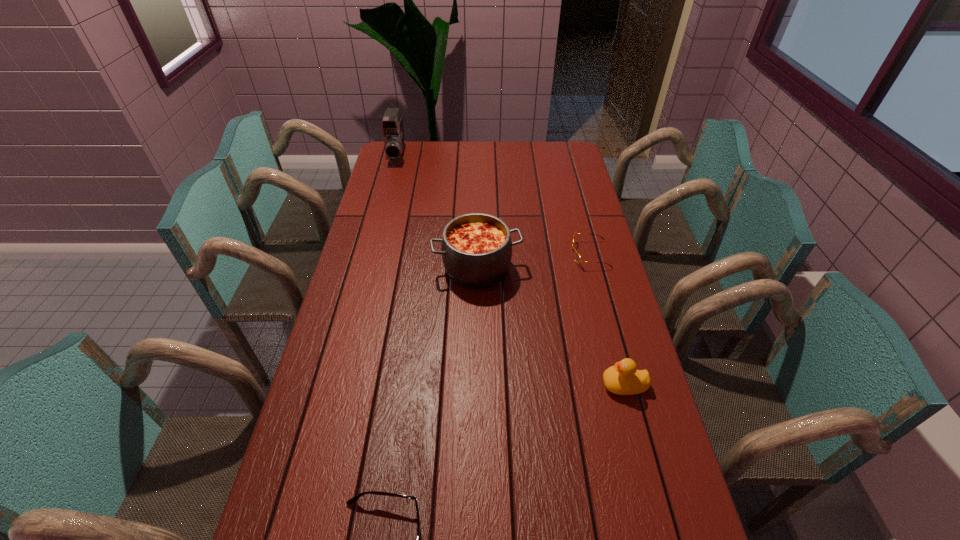
The width and height of the screenshot is (960, 540). Find the location of `free space that satisfies the following two spatial constraints: 1. at the front of the casserole, highlighting the lens; 2. on the left side of the tallest object`. free space that satisfies the following two spatial constraints: 1. at the front of the casserole, highlighting the lens; 2. on the left side of the tallest object is located at coordinates (367, 269).

Find the location of a particular element. The width and height of the screenshot is (960, 540). vacant space that satisfies the following two spatial constraints: 1. on the front-facing side of the farther spectacles; 2. on the front side of the casserole is located at coordinates (594, 269).